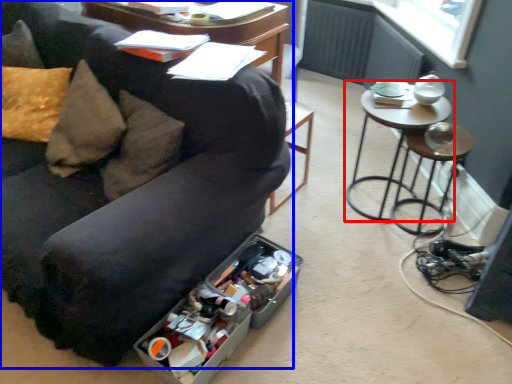
Question: Among these objects, which one is nearest to the camera, table (highlighted by a red box) or studio couch (highlighted by a blue box)?

Choices:
 (A) table
 (B) studio couch

Answer: (B)